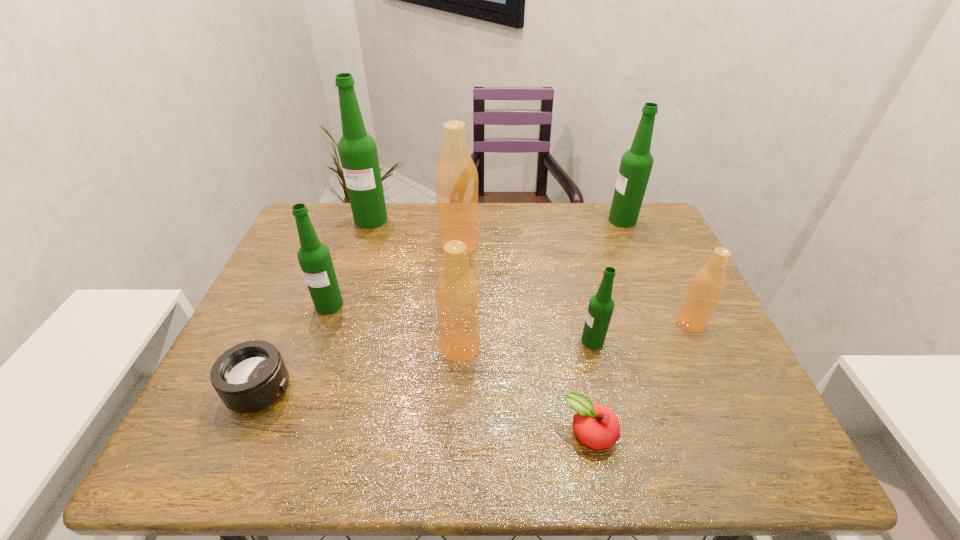
The image size is (960, 540). What are the coordinates of `free spot at the near edge of the desktop` in the screenshot? It's located at (539, 456).

In order to click on vacant space at the right edge of the desktop in this screenshot , I will do `click(671, 258)`.

The image size is (960, 540). I want to click on blank space at the near right corner, so click(744, 448).

The image size is (960, 540). I want to click on free space between the telephoto lens and the biggest tan beer bottle, so pos(359,318).

Locate an element on the screen. The height and width of the screenshot is (540, 960). blank region between the rightmost green beer bottle and the rightmost tan beer bottle is located at coordinates (657, 271).

I want to click on vacant point located between the third farthest object and the red apple, so click(524, 340).

Where is `empty space between the tallest beer bottle and the third smallest green beer bottle`? The image size is (960, 540). empty space between the tallest beer bottle and the third smallest green beer bottle is located at coordinates (497, 220).

This screenshot has height=540, width=960. Identify the location of unoccupied area between the apple and the second smallest tan beer bottle. (525, 390).

Find the location of a particular element. This screenshot has height=540, width=960. free spot between the second biggest green beer bottle and the second biggest tan beer bottle is located at coordinates (541, 284).

Where is `vacant space that is in between the apple and the third farthest green beer bottle`? vacant space that is in between the apple and the third farthest green beer bottle is located at coordinates (460, 369).